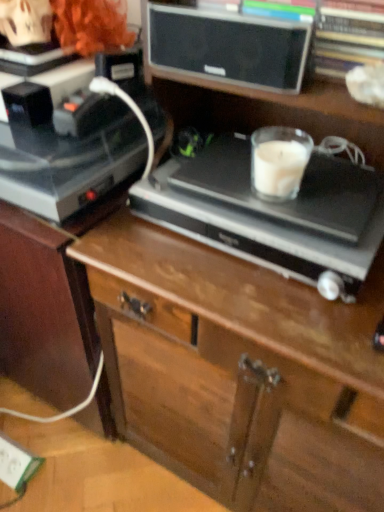
Question: Does wooden chest of drawers at center lie behind satin black record player at center, the first appliance positioned from the right?

Choices:
 (A) no
 (B) yes

Answer: (A)

Question: From a real-world perspective, is wooden chest of drawers at center positioned under satin black record player at center, the first appliance positioned from the right, based on gravity?

Choices:
 (A) no
 (B) yes

Answer: (B)

Question: Is wooden chest of drawers at center looking in the opposite direction of satin black record player at center, the first appliance positioned from the right?

Choices:
 (A) yes
 (B) no

Answer: (A)

Question: Is wooden chest of drawers at center facing towards satin black record player at center, the first appliance positioned from the right?

Choices:
 (A) yes
 (B) no

Answer: (A)

Question: From the image's perspective, is wooden chest of drawers at center beneath satin black record player at center, the first appliance positioned from the right?

Choices:
 (A) yes
 (B) no

Answer: (A)

Question: Can you confirm if wooden chest of drawers at center is bigger than satin black record player at center, the first appliance positioned from the right?

Choices:
 (A) no
 (B) yes

Answer: (B)

Question: Is satin black record player at center, positioned as the second appliance in left-to-right order, turned away from matte black speaker at upper center?

Choices:
 (A) yes
 (B) no

Answer: (B)

Question: Is satin black record player at center, the first appliance positioned from the right, positioned behind matte black speaker at upper center?

Choices:
 (A) yes
 (B) no

Answer: (A)

Question: Considering the relative sizes of satin black record player at center, positioned as the second appliance in left-to-right order, and matte black speaker at upper center in the image provided, is satin black record player at center, positioned as the second appliance in left-to-right order, bigger than matte black speaker at upper center?

Choices:
 (A) no
 (B) yes

Answer: (B)

Question: From the image's perspective, is satin black record player at center, positioned as the second appliance in left-to-right order, located above matte black speaker at upper center?

Choices:
 (A) yes
 (B) no

Answer: (B)

Question: Can we say satin black record player at center, the first appliance positioned from the right, lies outside matte black speaker at upper center?

Choices:
 (A) yes
 (B) no

Answer: (A)

Question: Considering the relative positions of satin black record player at center, positioned as the second appliance in left-to-right order, and matte black speaker at upper center in the image provided, is satin black record player at center, positioned as the second appliance in left-to-right order, to the right of matte black speaker at upper center from the viewer's perspective?

Choices:
 (A) yes
 (B) no

Answer: (A)

Question: Considering the relative sizes of satin black record player at center, positioned as the second appliance in left-to-right order, and white plastic electric outlet at lower left in the image provided, is satin black record player at center, positioned as the second appliance in left-to-right order, wider than white plastic electric outlet at lower left?

Choices:
 (A) yes
 (B) no

Answer: (A)